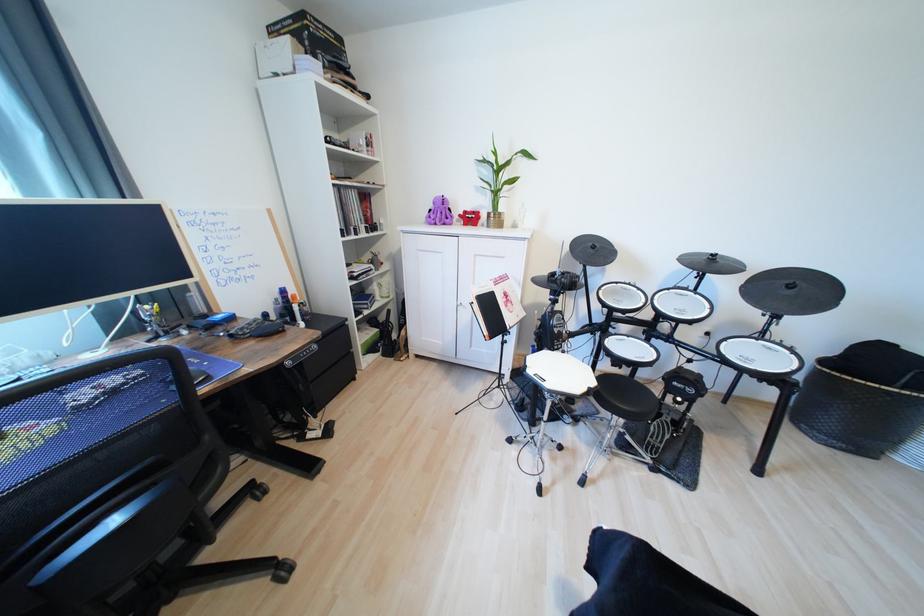
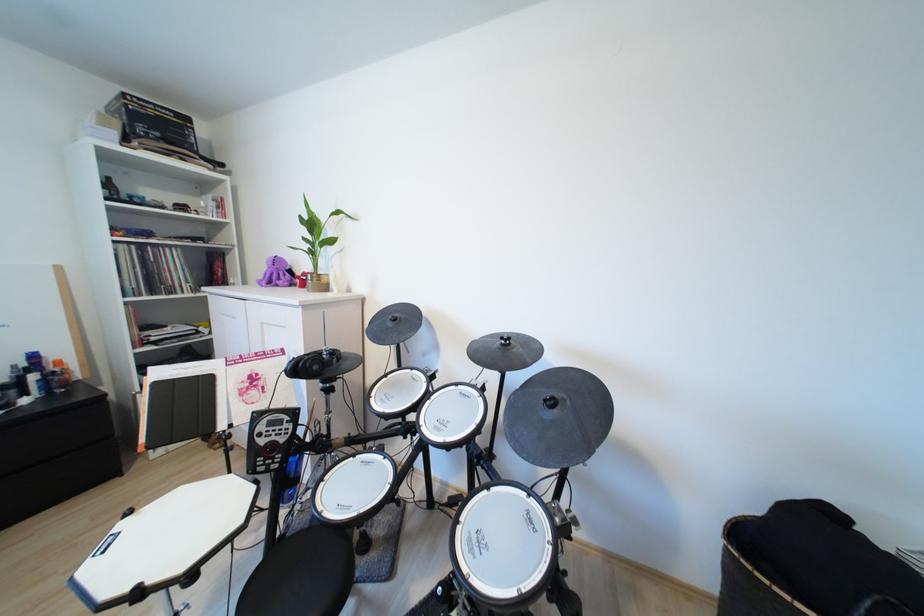
In the second image, find the point that corresponds to (600,384) in the first image.

(190, 568)